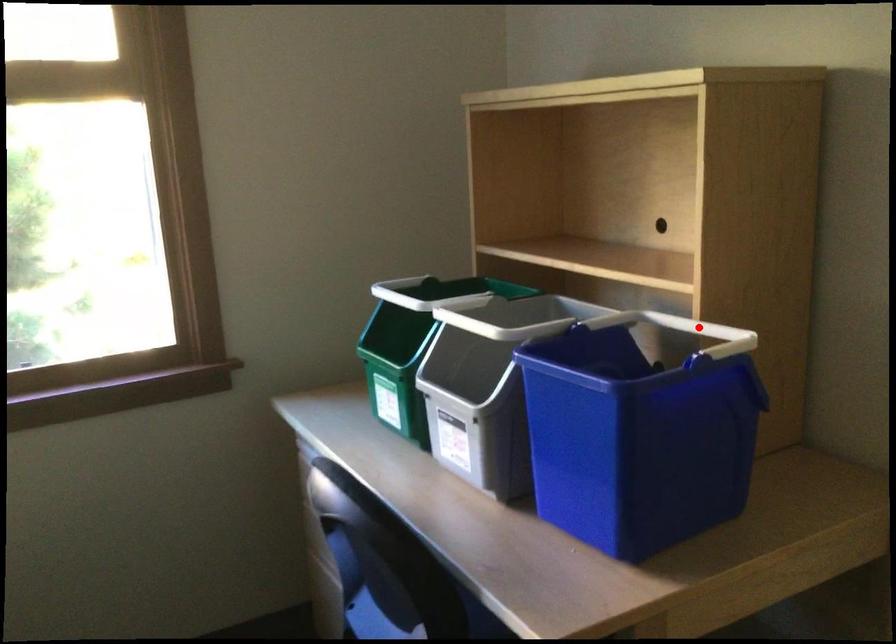
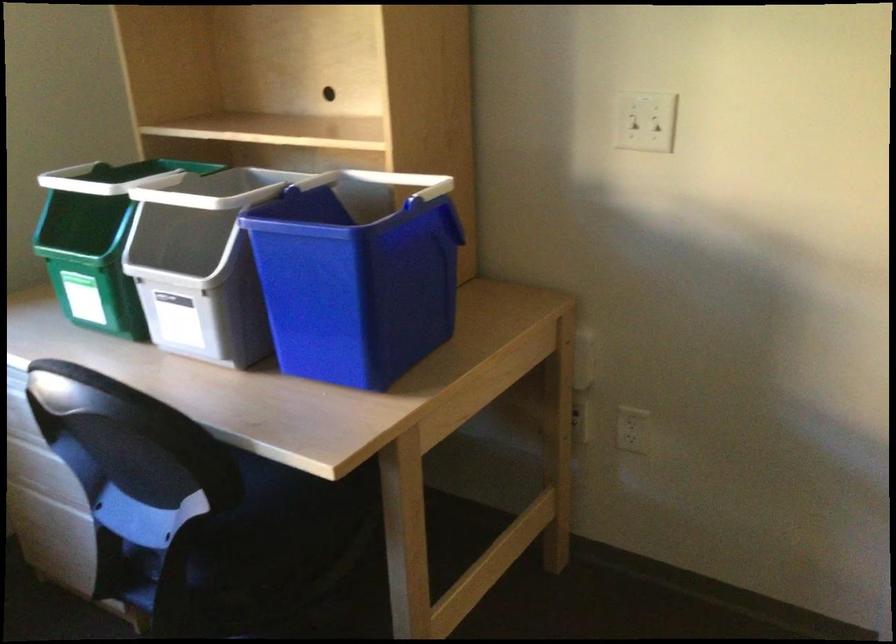
Locate, in the second image, the point that corresponds to the highlighted location in the first image.

(399, 181)